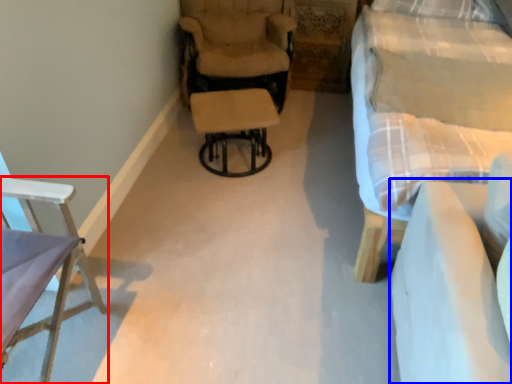
Question: Which of the following is the farthest to the observer, chair (highlighted by a red box) or couch (highlighted by a blue box)?

Choices:
 (A) chair
 (B) couch

Answer: (A)